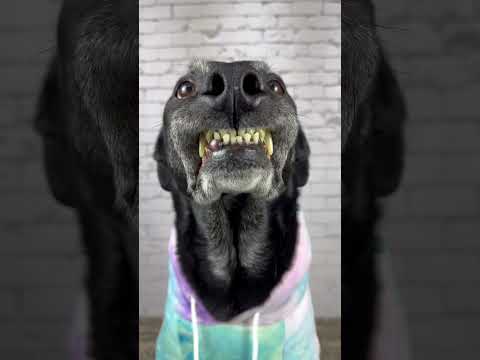
Identify the location of floor. This screenshot has width=480, height=360. (328, 336).